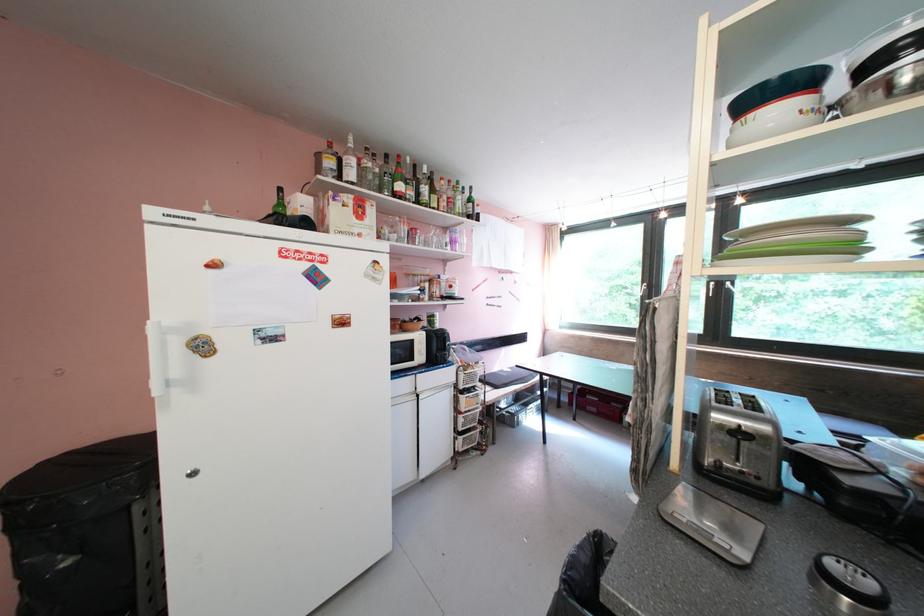
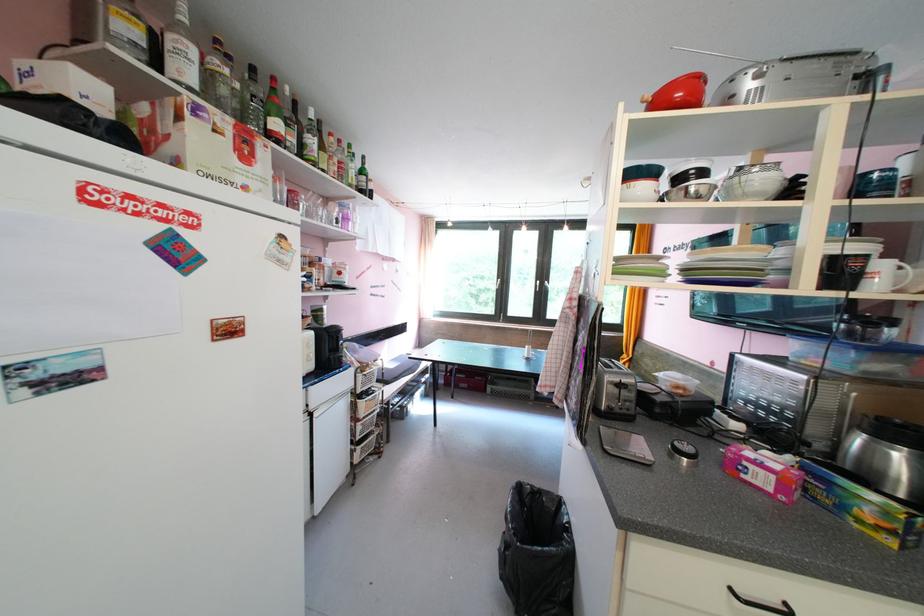
Question: The camera is either moving clockwise (left) or counter-clockwise (right) around the object. The first image is from the beginning of the video and the second image is from the end. Is the camera moving left or right when shooting the video?

Choices:
 (A) Left
 (B) Right

Answer: (A)